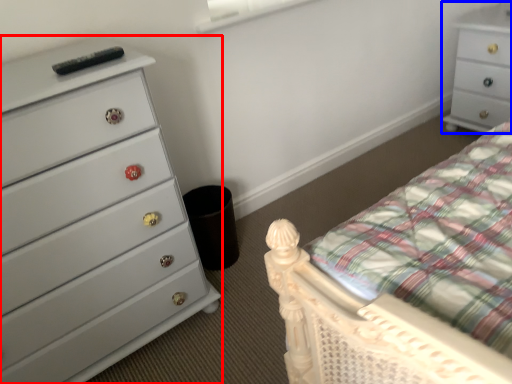
Question: Which of the following is the closest to the observer, chest of drawers (highlighted by a red box) or chest of drawers (highlighted by a blue box)?

Choices:
 (A) chest of drawers
 (B) chest of drawers

Answer: (A)